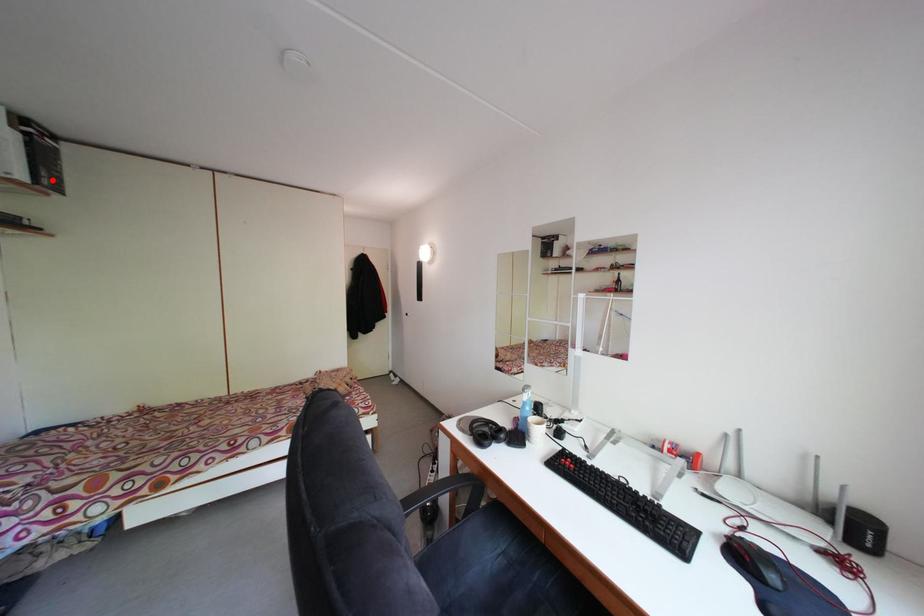
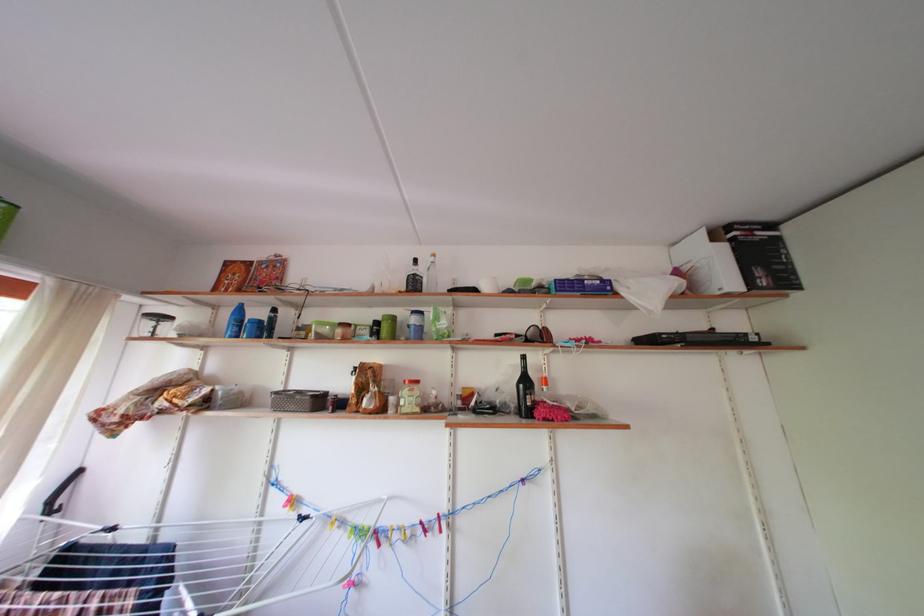
The point at the highlighted location is marked in the first image. Where is the corresponding point in the second image?

(768, 278)